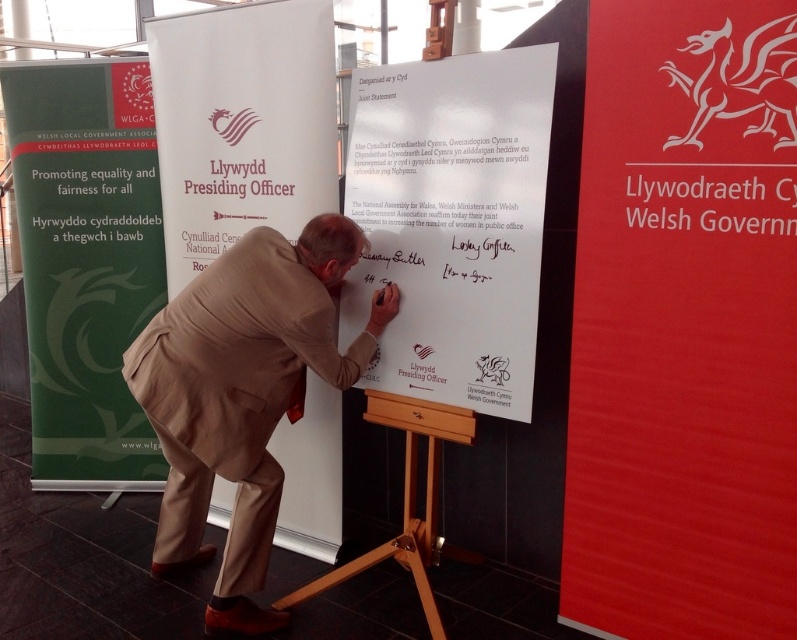
Question: Which of the following is the farthest from the observer?

Choices:
 (A) red matte sign at right
 (B) green fabric banner at left
 (C) wooden at center

Answer: (B)

Question: Observing the image, what is the correct spatial positioning of red matte sign at right in reference to white paper at center?

Choices:
 (A) below
 (B) above

Answer: (A)

Question: Which object is farther from the camera taking this photo?

Choices:
 (A) beige fabric suit at center
 (B) white paper at center

Answer: (B)

Question: Which point is farther from the camera taking this photo?

Choices:
 (A) (134, 163)
 (B) (377, 548)
 (C) (152, 44)

Answer: (A)

Question: Is red matte sign at right further to camera compared to green fabric banner at left?

Choices:
 (A) yes
 (B) no

Answer: (B)

Question: Can you confirm if green fabric banner at left is thinner than white paper at center?

Choices:
 (A) no
 (B) yes

Answer: (B)